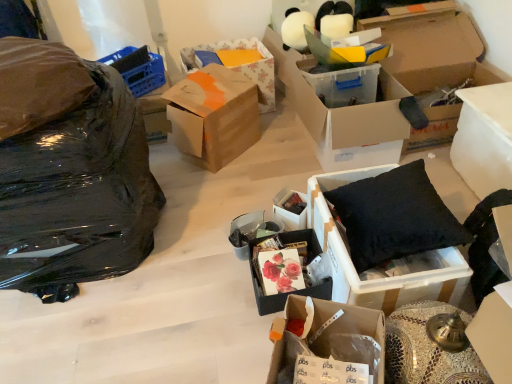
Image resolution: width=512 pixels, height=384 pixels. Find the location of `vacant space that is in between brown cardboard box at center, placed as the first box when sorted from left to right, and matte floral print box at center, acting as the seventh box starting from the right`. vacant space that is in between brown cardboard box at center, placed as the first box when sorted from left to right, and matte floral print box at center, acting as the seventh box starting from the right is located at coordinates click(x=240, y=189).